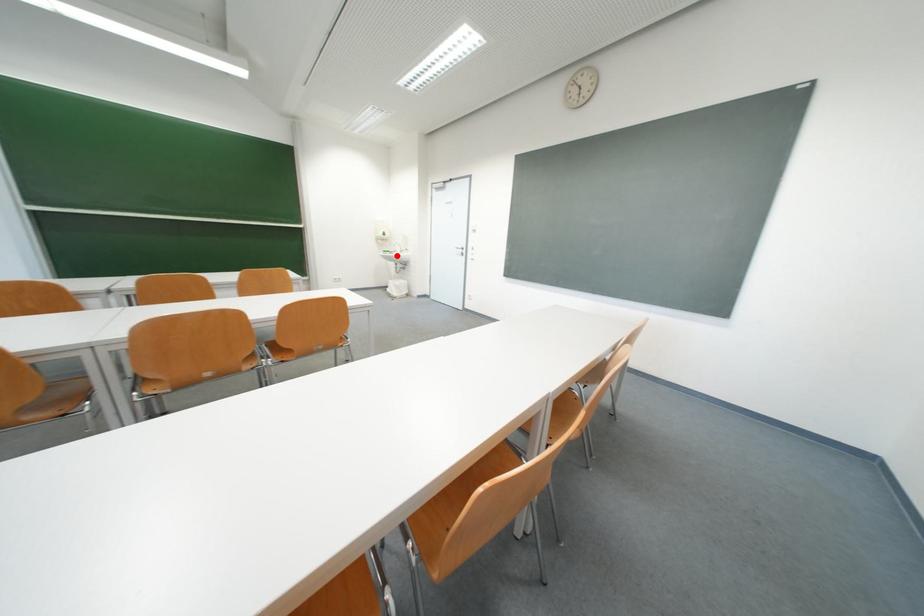
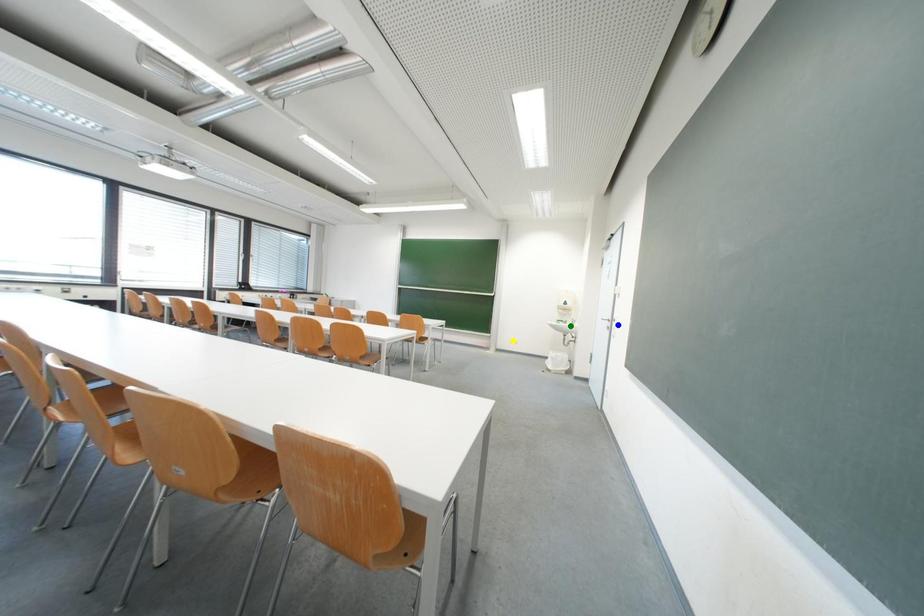
Question: I am providing you with two images of the same scene from different viewpoints. A red point is marked on the first image. You are given multiple points on the second image. Which point in image 2 is actually the same real-world point as the red point in image 1?

Choices:
 (A) yellow point
 (B) green point
 (C) blue point

Answer: (B)